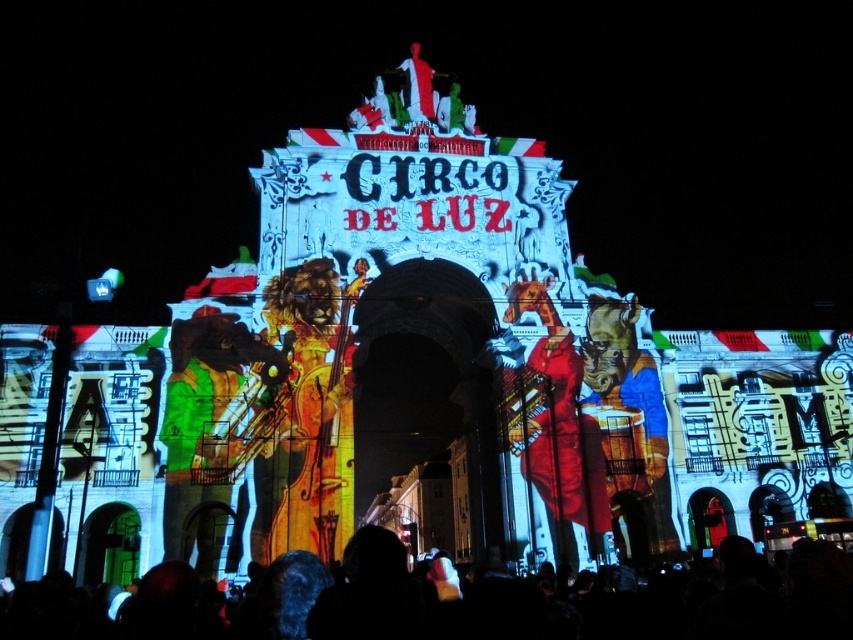
Question: Which point is farther to the camera?

Choices:
 (A) (172, 468)
 (B) (613, 307)
 (C) (509, 620)

Answer: (B)

Question: Which point is closer to the camera?

Choices:
 (A) black matte crowd at lower center
 (B) metallic gold statue at center
 (C) green fabric musician at center

Answer: (A)

Question: Is black matte crowd at lower center thinner than shiny gold violin at center?

Choices:
 (A) yes
 (B) no

Answer: (B)

Question: Can you confirm if black matte crowd at lower center is smaller than green fabric musician at center?

Choices:
 (A) no
 (B) yes

Answer: (A)

Question: Which object is positioned closest to the black matte crowd at lower center?

Choices:
 (A) green fabric musician at center
 (B) metallic gold statue at center
 (C) shiny gold violin at center

Answer: (C)

Question: Can you confirm if shiny gold violin at center is positioned above metallic gold statue at center?

Choices:
 (A) yes
 (B) no

Answer: (A)